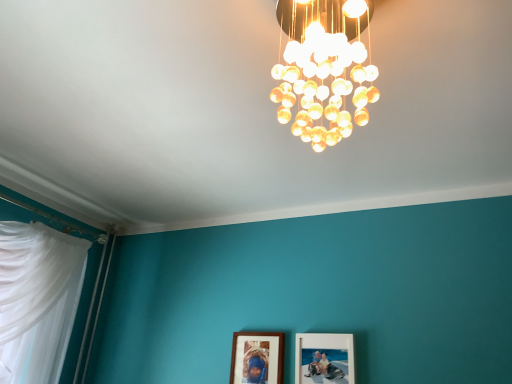
Question: Is wooden picture frame at center, acting as the 2th picture frame starting from the right, to the left of matte wooden picture frame at lower center, which is counted as the first picture frame, starting from the right, from the viewer's perspective?

Choices:
 (A) yes
 (B) no

Answer: (A)

Question: Considering the relative sizes of wooden picture frame at center, acting as the 2th picture frame starting from the right, and matte wooden picture frame at lower center, which appears as the second picture frame when viewed from the left, in the image provided, is wooden picture frame at center, acting as the 2th picture frame starting from the right, smaller than matte wooden picture frame at lower center, which appears as the second picture frame when viewed from the left,?

Choices:
 (A) no
 (B) yes

Answer: (B)

Question: Considering the relative positions of wooden picture frame at center, acting as the 2th picture frame starting from the right, and matte wooden picture frame at lower center, which appears as the second picture frame when viewed from the left, in the image provided, is wooden picture frame at center, acting as the 2th picture frame starting from the right, behind matte wooden picture frame at lower center, which appears as the second picture frame when viewed from the left,?

Choices:
 (A) yes
 (B) no

Answer: (A)

Question: Does wooden picture frame at center, the first picture frame when ordered from left to right, turn towards matte wooden picture frame at lower center, which is counted as the first picture frame, starting from the right?

Choices:
 (A) no
 (B) yes

Answer: (A)

Question: Are wooden picture frame at center, the first picture frame when ordered from left to right, and matte wooden picture frame at lower center, which appears as the second picture frame when viewed from the left, beside each other?

Choices:
 (A) yes
 (B) no

Answer: (B)

Question: From the image's perspective, is wooden picture frame at center, the first picture frame when ordered from left to right, above matte wooden picture frame at lower center, which is counted as the first picture frame, starting from the right?

Choices:
 (A) no
 (B) yes

Answer: (A)

Question: From the image's perspective, is translucent glass chandelier at upper center above matte wooden picture frame at lower center, which appears as the second picture frame when viewed from the left?

Choices:
 (A) yes
 (B) no

Answer: (A)

Question: Does translucent glass chandelier at upper center have a larger size compared to matte wooden picture frame at lower center, which is counted as the first picture frame, starting from the right?

Choices:
 (A) no
 (B) yes

Answer: (B)

Question: Can you confirm if translucent glass chandelier at upper center is thinner than matte wooden picture frame at lower center, which is counted as the first picture frame, starting from the right?

Choices:
 (A) yes
 (B) no

Answer: (B)

Question: Is translucent glass chandelier at upper center wider than matte wooden picture frame at lower center, which is counted as the first picture frame, starting from the right?

Choices:
 (A) no
 (B) yes

Answer: (B)

Question: Is translucent glass chandelier at upper center located outside matte wooden picture frame at lower center, which is counted as the first picture frame, starting from the right?

Choices:
 (A) yes
 (B) no

Answer: (A)

Question: From a real-world perspective, does translucent glass chandelier at upper center sit lower than matte wooden picture frame at lower center, which appears as the second picture frame when viewed from the left?

Choices:
 (A) no
 (B) yes

Answer: (A)

Question: Is translucent glass chandelier at upper center shorter than wooden picture frame at center, the first picture frame when ordered from left to right?

Choices:
 (A) no
 (B) yes

Answer: (A)